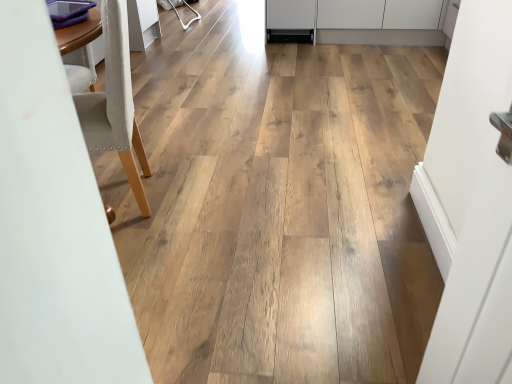
Locate an element on the screen. This screenshot has width=512, height=384. vacant area that is in front of white fabric chair at left is located at coordinates (150, 249).